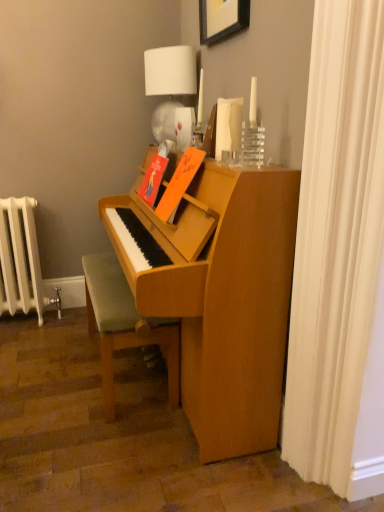
Question: From a real-world perspective, is white fabric lampshade at upper center physically located above or below white fabric shower curtain at right?

Choices:
 (A) above
 (B) below

Answer: (A)

Question: Visually, is white fabric lampshade at upper center positioned to the left or to the right of white fabric shower curtain at right?

Choices:
 (A) left
 (B) right

Answer: (A)

Question: Which object is the closest to the white fabric lampshade at upper center?

Choices:
 (A) light brown wooden bench at lower center
 (B) wooden picture frame at upper center
 (C) white fabric shower curtain at right
 (D) white painted metal radiator at left

Answer: (B)

Question: Considering the real-world distances, which object is farthest from the wooden picture frame at upper center?

Choices:
 (A) white fabric lampshade at upper center
 (B) light brown wooden bench at lower center
 (C) white fabric shower curtain at right
 (D) white painted metal radiator at left

Answer: (D)